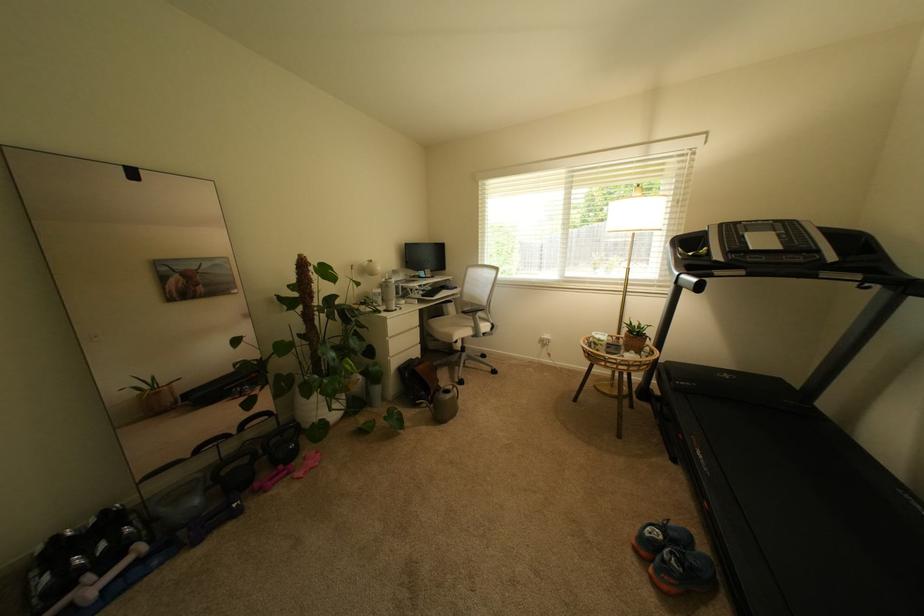
What do you see at coordinates (460, 309) in the screenshot? The image size is (924, 616). I see `the white chair armrest` at bounding box center [460, 309].